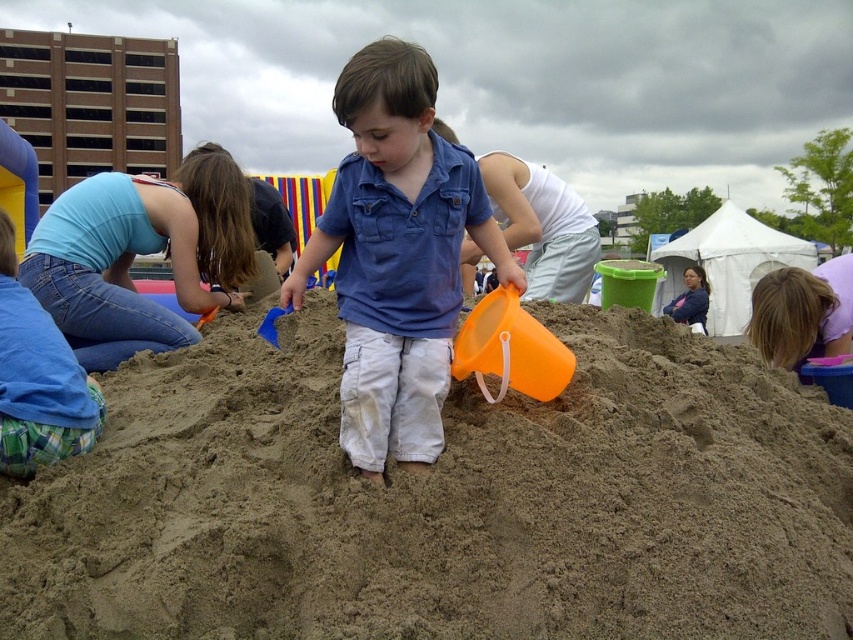
Is smooth sand mound at center wider than blue denim shirt at center?

Correct, the width of smooth sand mound at center exceeds that of blue denim shirt at center.

Consider the image. Who is shorter, smooth sand mound at center or blue denim shirt at center?

smooth sand mound at center

This screenshot has width=853, height=640. I want to click on smooth sand mound at center, so click(444, 500).